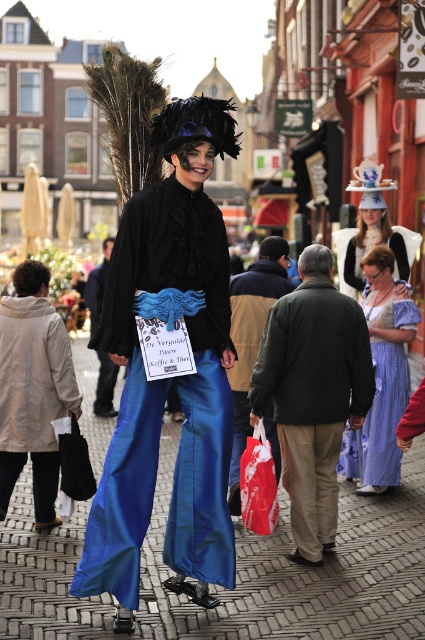
You are a photographer at the event and want to capture the figure on stilts. You notice the dark green jacket at center and the blue fabric pants at center. Which clothing item is positioned lower on the figure?

The dark green jacket at center is below the blue fabric pants at center, so the dark green jacket at center is positioned lower on the figure.